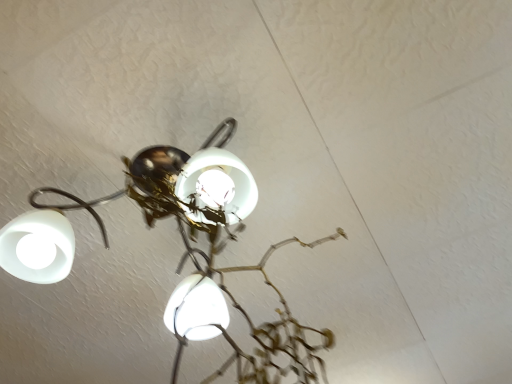
Question: Should I look upward or downward to see white glossy lamp at upper left?

Choices:
 (A) up
 (B) down

Answer: (B)